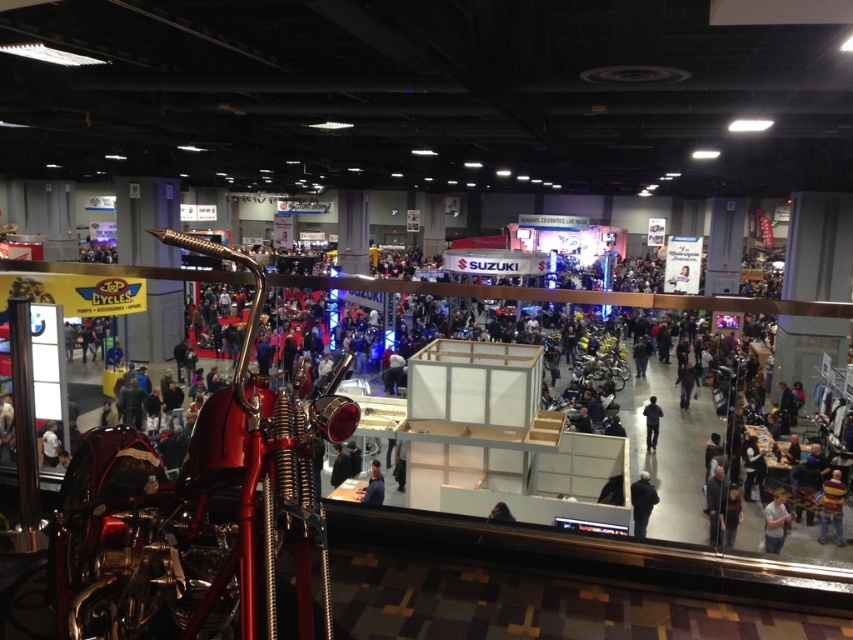
Is striped sweater at lower right wider than silhouette figure at center?

Correct, the width of striped sweater at lower right exceeds that of silhouette figure at center.

Is striped sweater at lower right shorter than silhouette figure at center?

Indeed, striped sweater at lower right has a lesser height compared to silhouette figure at center.

At what (x,y) coordinates should I click in order to perform the action: click on striped sweater at lower right. Please return your answer as a coordinate pair (x, y). The width and height of the screenshot is (853, 640). Looking at the image, I should click on pos(831,506).

Can you confirm if shiny chrome motorcycle at lower left is thinner than dark gray fabric jacket at lower right?

Indeed, shiny chrome motorcycle at lower left has a lesser width compared to dark gray fabric jacket at lower right.

Is shiny chrome motorcycle at lower left above dark gray fabric jacket at lower right?

Actually, shiny chrome motorcycle at lower left is below dark gray fabric jacket at lower right.

Measure the distance between shiny chrome motorcycle at lower left and camera.

13.50 meters

This screenshot has width=853, height=640. Find the location of `shiny chrome motorcycle at lower left`. shiny chrome motorcycle at lower left is located at coordinates (495, 440).

Looking at this image, does striped sweater at lower right come behind dark gray fabric jacket at lower right?

Yes.

Image resolution: width=853 pixels, height=640 pixels. Identify the location of striped sweater at lower right. (831, 506).

Who is more forward, (833,468) or (631,500)?

Point (631,500)

Image resolution: width=853 pixels, height=640 pixels. I want to click on striped sweater at lower right, so click(x=831, y=506).